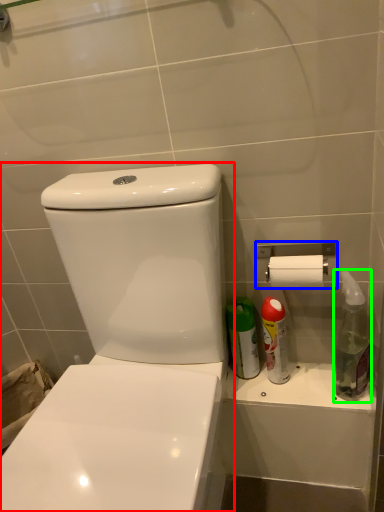
Question: Which object is positioned farthest from toilet (highlighted by a red box)? Select from towel bar (highlighted by a blue box) and cleaning product (highlighted by a green box).

Choices:
 (A) towel bar
 (B) cleaning product

Answer: (B)